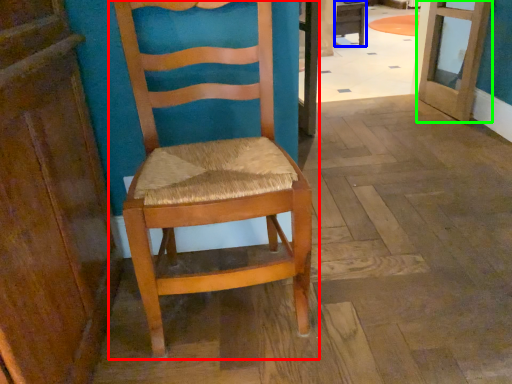
Question: Estimate the real-world distances between objects in this image. Which object is closer to chair (highlighted by a red box), table (highlighted by a blue box) or door (highlighted by a green box)?

Choices:
 (A) table
 (B) door

Answer: (B)